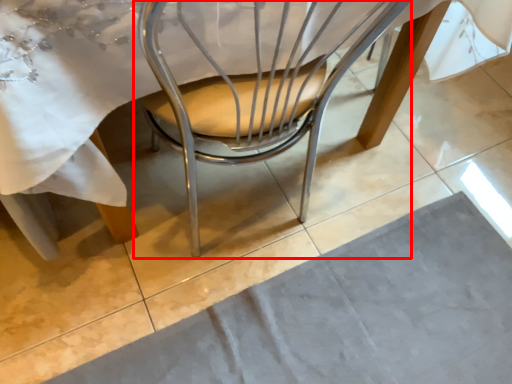
Question: Where is chair (annotated by the red box) located in relation to place mat in the image?

Choices:
 (A) left
 (B) right

Answer: (A)